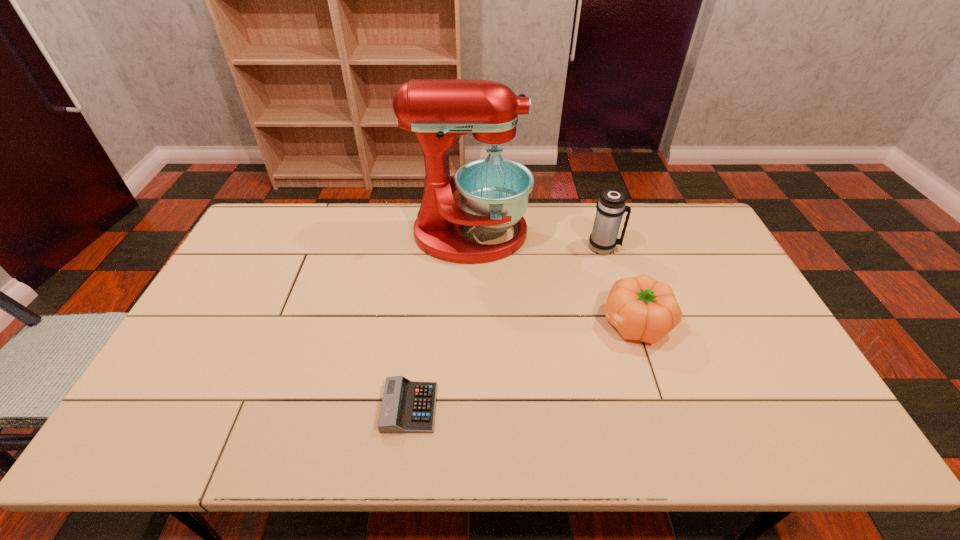
In the image, there is a desktop. At what (x,y) coordinates should I click in order to perform the action: click on vacant region at the far right corner. Please return your answer as a coordinate pair (x, y). Looking at the image, I should click on (691, 215).

This screenshot has height=540, width=960. I want to click on unoccupied area between the calculator and the thermos bottle, so click(x=507, y=327).

This screenshot has height=540, width=960. I want to click on free space between the third tallest object and the shortest object, so click(x=522, y=365).

Locate an element on the screen. vacant region between the second tallest object and the nearest object is located at coordinates (507, 327).

At what (x,y) coordinates should I click in order to perform the action: click on vacant area between the third tallest object and the tallest object. Please return your answer as a coordinate pair (x, y). Looking at the image, I should click on (552, 279).

I want to click on free space between the calculator and the thermos bottle, so click(x=507, y=327).

The height and width of the screenshot is (540, 960). In order to click on free space between the shortest object and the thermos bottle in this screenshot , I will do `click(507, 327)`.

Locate which object ranks third in proximity to the mixer. Please provide its 2D coordinates. Your answer should be formatted as a tuple, i.e. [(x, y)], where the tuple contains the x and y coordinates of a point satisfying the conditions above.

[(407, 406)]

Identify the location of object that ranks as the third closest to the third farthest object. The width and height of the screenshot is (960, 540). (407, 406).

In order to click on free spot that satisfies the following two spatial constraints: 1. on the carved face of the pumpkin; 2. on the front side of the nearest object in this screenshot , I will do `click(662, 407)`.